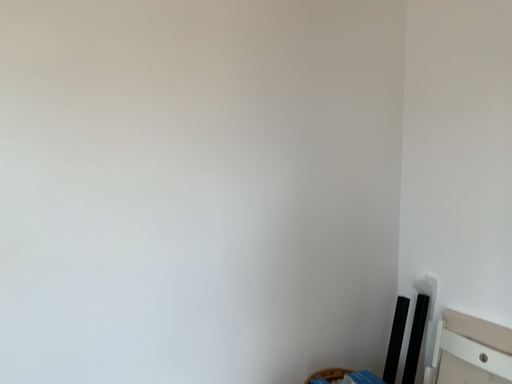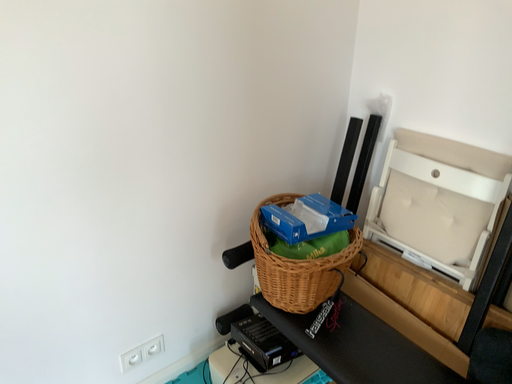
Question: Which way did the camera rotate in the video?

Choices:
 (A) rotated downward
 (B) rotated upward

Answer: (A)